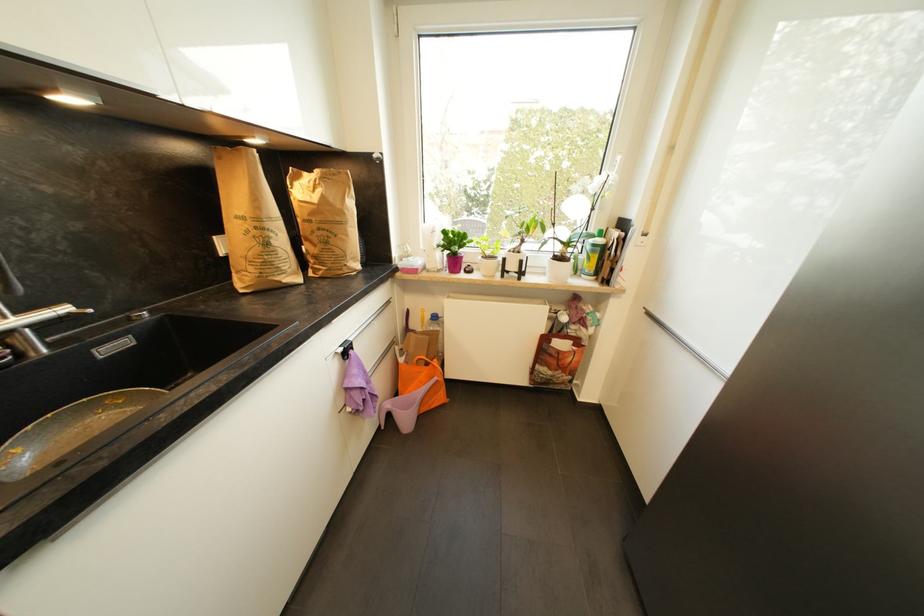
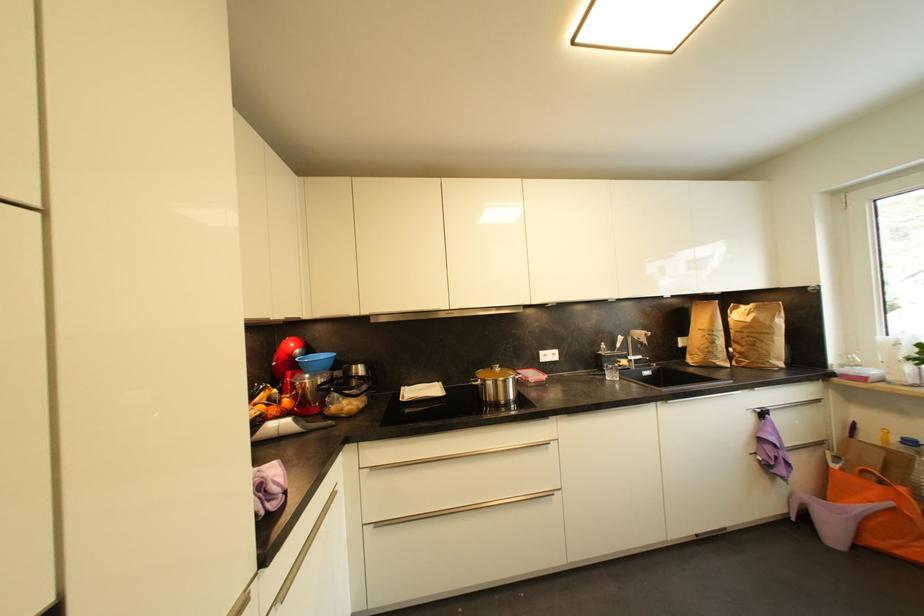
Locate, in the second image, the point that corresponds to [272,246] in the first image.

(718, 345)